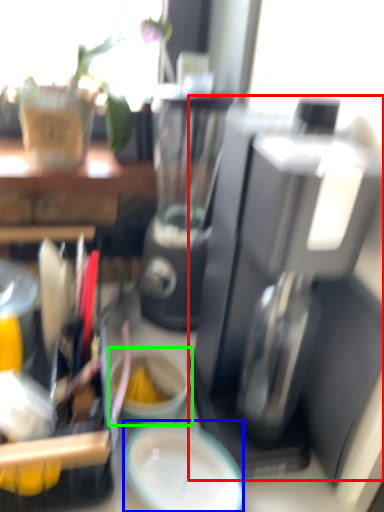
Question: Estimate the real-world distances between objects in this image. Which object is farther from coffee maker (highlighted by a red box), plate (highlighted by a blue box) or coffee cup (highlighted by a green box)?

Choices:
 (A) plate
 (B) coffee cup

Answer: (B)